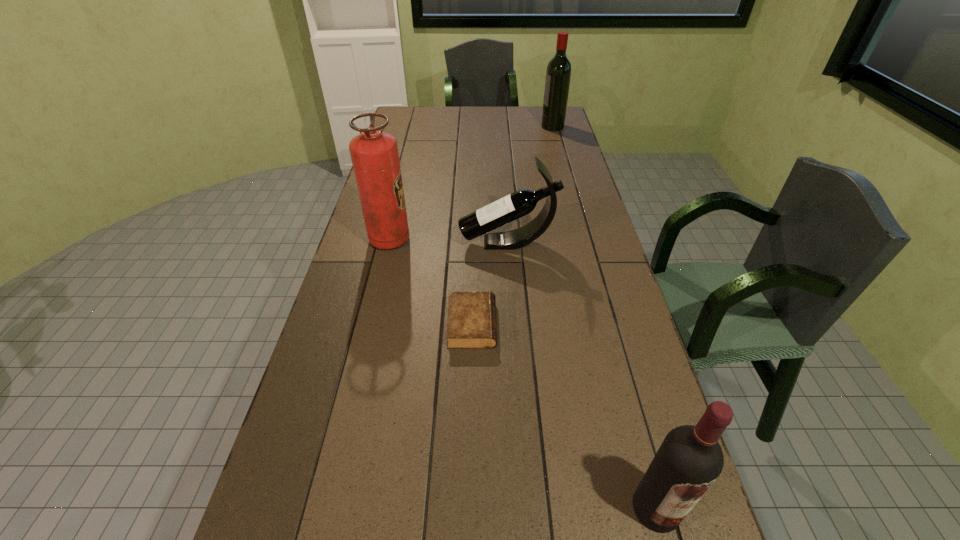
The image size is (960, 540). Identify the location of empty space that is in between the fire extinguisher and the farthest object. (471, 183).

You are a GUI agent. You are given a task and a screenshot of the screen. Output one action in this format:
    pyautogui.click(x=<x>, y=<y>)
    Task: Click on the free spot between the leftmost object and the nearest wine bottle
    
    Given the screenshot: What is the action you would take?
    pyautogui.click(x=523, y=374)

Locate an element on the screen. object identified as the third closest to the fire extinguisher is located at coordinates point(689,460).

Point out which object is positioned as the fourth nearest to the fourth farthest object. Please provide its 2D coordinates. Your answer should be formatted as a tuple, i.e. [(x, y)], where the tuple contains the x and y coordinates of a point satisfying the conditions above.

[(558, 74)]

Select which wine bottle is the closest to the diary. Please provide its 2D coordinates. Your answer should be formatted as a tuple, i.e. [(x, y)], where the tuple contains the x and y coordinates of a point satisfying the conditions above.

[(522, 202)]

Identify which wine bottle is the second nearest to the nearest object. Please provide its 2D coordinates. Your answer should be formatted as a tuple, i.e. [(x, y)], where the tuple contains the x and y coordinates of a point satisfying the conditions above.

[(558, 74)]

What are the coordinates of `blank area in the image that satisfies the following two spatial constraints: 1. on the label of the farthest object; 2. on the label of the nearest wine bottle` in the screenshot? It's located at [x=659, y=508].